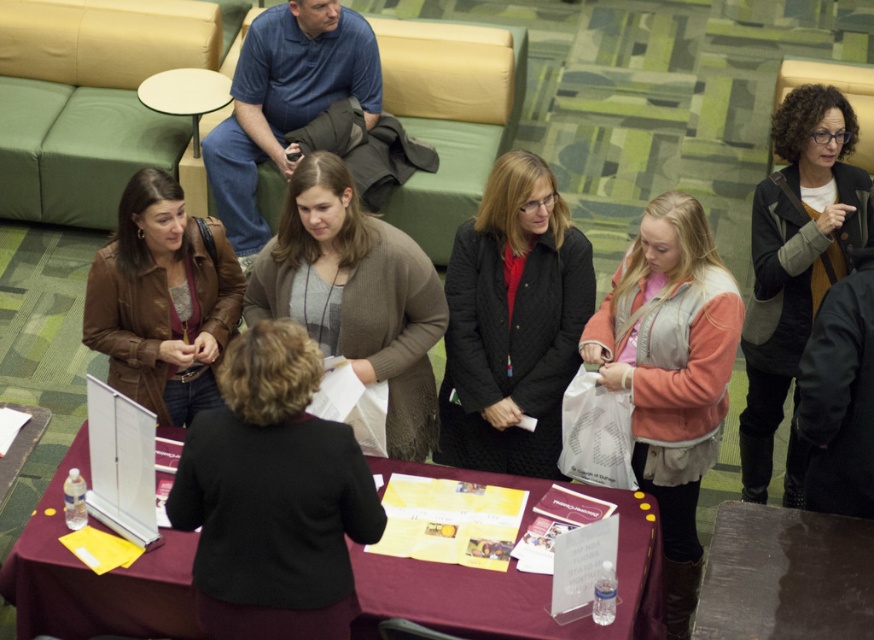
Question: Which of the following is the closest to the observer?

Choices:
 (A) quilted black jacket at center
 (B) brown leather table at lower right
 (C) dark gray sweater at upper right
 (D) brown leather jacket at left

Answer: (B)

Question: From the image, what is the correct spatial relationship of maroon fabric table at center in relation to gray knit cardigan at center?

Choices:
 (A) below
 (B) above

Answer: (A)

Question: Can you confirm if quilted black jacket at center is smaller than light pink fleece vest at center?

Choices:
 (A) yes
 (B) no

Answer: (B)

Question: Is maroon fabric table at center smaller than quilted black jacket at center?

Choices:
 (A) yes
 (B) no

Answer: (A)

Question: Which of the following is the closest to the observer?

Choices:
 (A) (227, 280)
 (B) (770, 420)

Answer: (A)

Question: Which object appears farthest from the camera in this image?

Choices:
 (A) brown leather table at lower right
 (B) light pink fleece vest at center

Answer: (B)